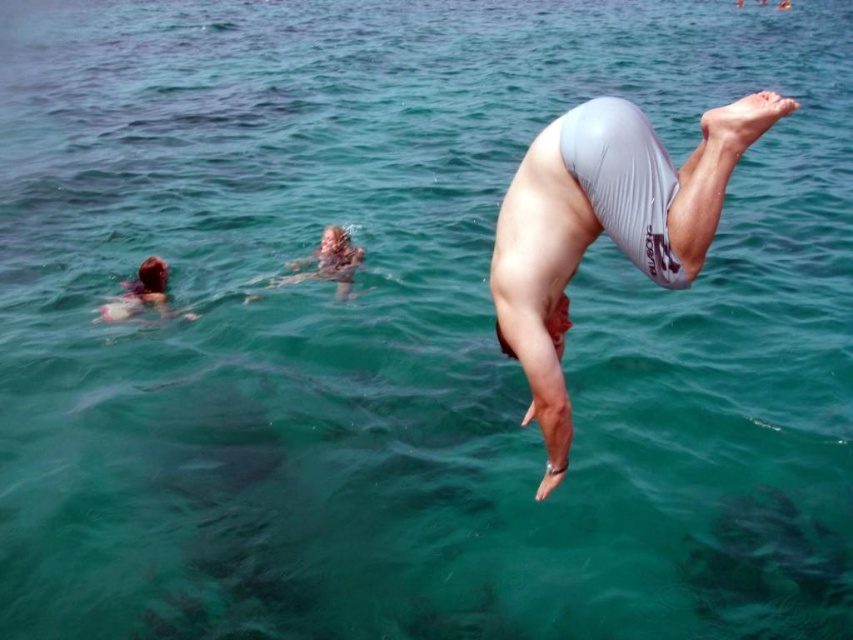
Question: Which point is closer to the camera taking this photo?

Choices:
 (A) (131, 289)
 (B) (616, 237)

Answer: (B)

Question: Does white matte shorts at center have a lesser width compared to blonde hair swimmer at left?

Choices:
 (A) no
 (B) yes

Answer: (A)

Question: Which point appears closest to the camera in this image?

Choices:
 (A) coord(109,301)
 (B) coord(683,257)

Answer: (B)

Question: Can you confirm if white matte shorts at center is wider than blonde hair swimmer at left?

Choices:
 (A) yes
 (B) no

Answer: (A)

Question: Which of the following is the farthest from the observer?

Choices:
 (A) (122, 310)
 (B) (660, 177)

Answer: (A)

Question: In this image, where is white matte shorts at center located relative to blonde hair swimmer at left?

Choices:
 (A) below
 (B) above

Answer: (B)